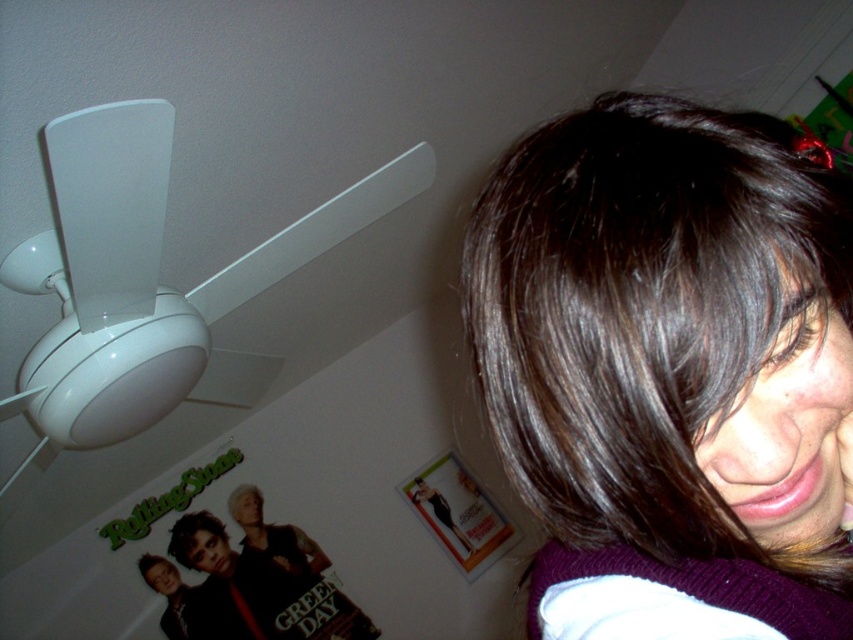
You are an interior designer assessing the wall space above a couch. You see the white matte ceiling fan at upper left and the matte black band poster at upper left. Which object occupies more vertical space on the wall?

The white matte ceiling fan at upper left is taller than the matte black band poster at upper left, so it occupies more vertical space on the wall.

You are standing in the room and see two points marked in the image. Which point is closer to you, point [724,499] or point [91,435]?

Point [724,499] is in front of point [91,435], so it is closer to you.

You are holding a 10 inch ruler and want to measure the distance from your eyes to the point marked as point (550, 282) in the image. Can you reach it with your ruler?

The distance between point (550, 282) and the viewer is 11.35 inches, so the 10 inch ruler is not long enough to measure the distance.